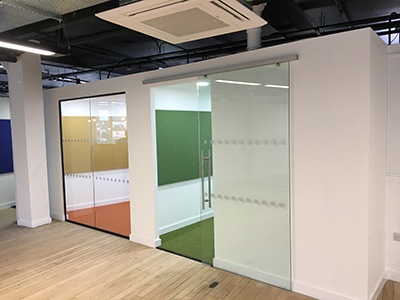
Find the location of a particular element. Image resolution: width=400 pixels, height=300 pixels. glass is located at coordinates (238, 160).